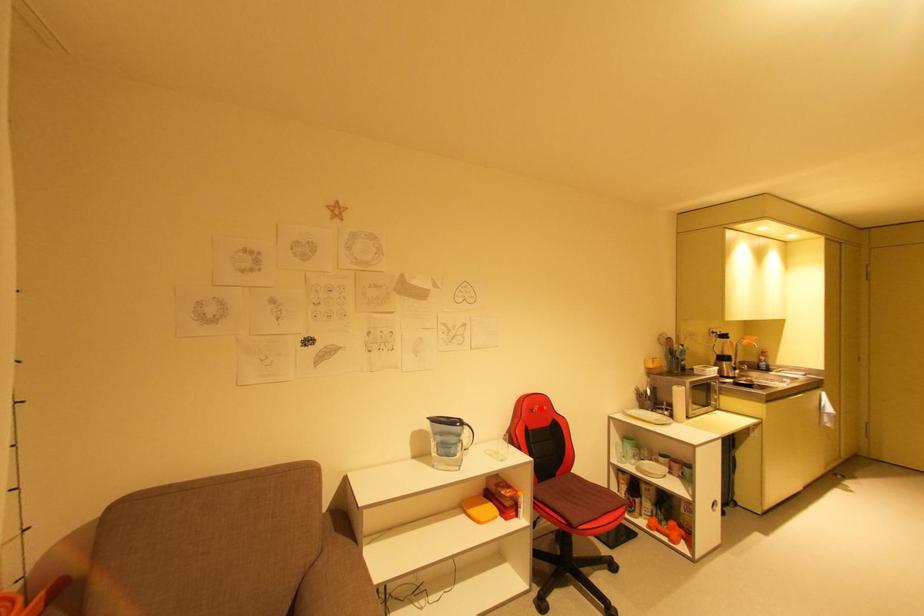
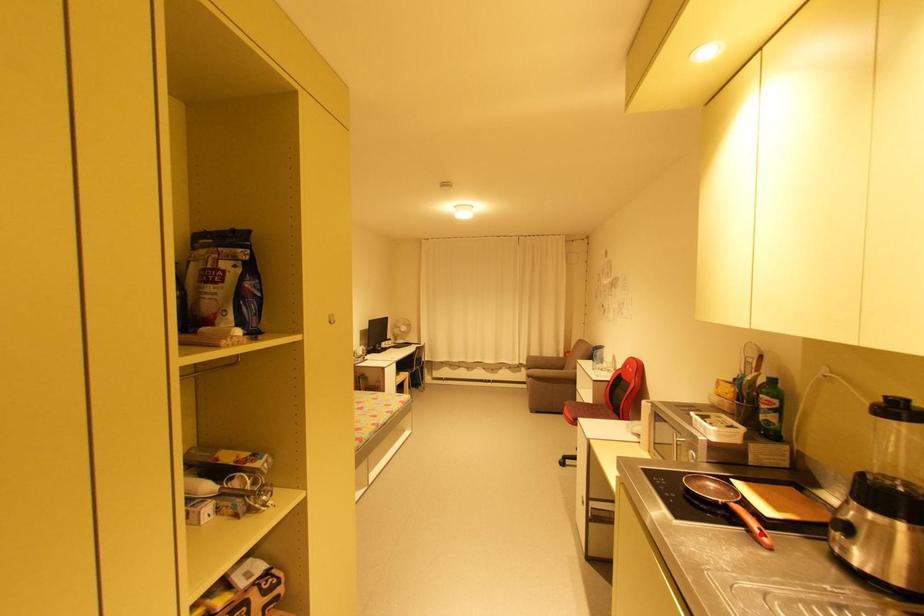
I am providing you with two images of the same scene from different viewpoints. A red point is marked on the first image and another point is marked on the second image. Is the marked point in image1 the same physical position as the marked point in image2?

No